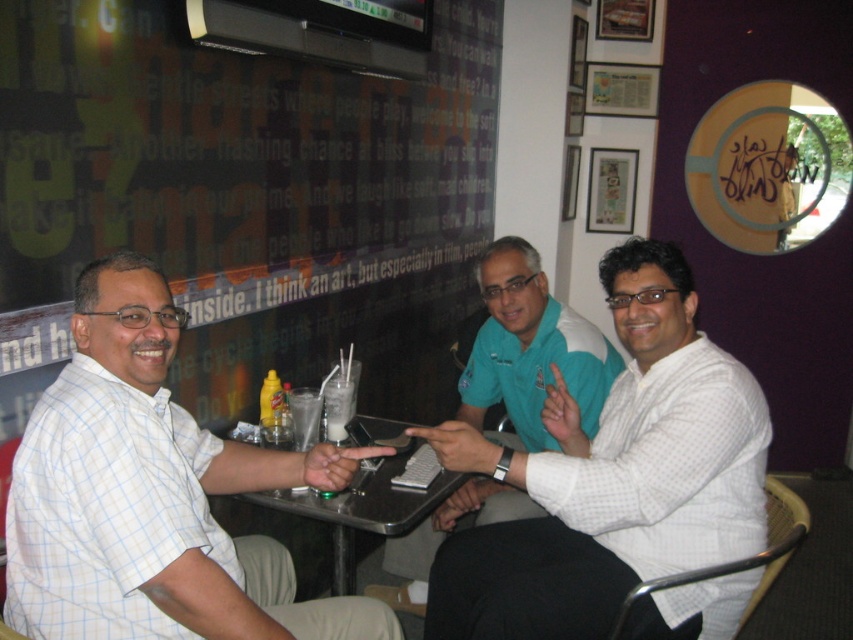
You are a waiter holding a tray with a new drink order for the table. The drink needs to be placed exactly 24 inches away from the white checkered shirt at left. Can you place the drink on the table near the milky white smoothie at center?

The distance between the white checkered shirt at left and the milky white smoothie at center is 24.52 inches. Since the required distance is 24 inches, placing the drink near the milky white smoothie at center would be close enough to meet the requirement.

You are standing at the entrance of the dining area and want to locate the white checkered shirt at center. According to the coordinates provided, where would you find it?

The white checkered shirt at center is located at coordinates point [613,476].

You are a waiter at this table. You need to deliver a napkin to the person wearing the white checkered shirt at left. Where should you place the napkin so that it is closest to their hand without touching the milky white smoothie at center?

Place the napkin near the edge of the table closest to the white checkered shirt at left, ensuring it is positioned below the milky white smoothie at center to avoid contact.